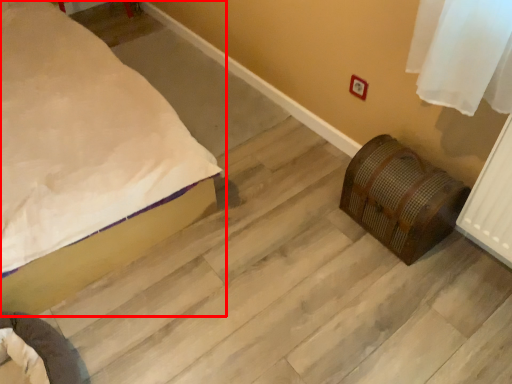
Question: From the image's perspective, where is bed (annotated by the red box) located in relation to furniture in the image?

Choices:
 (A) below
 (B) above

Answer: (B)